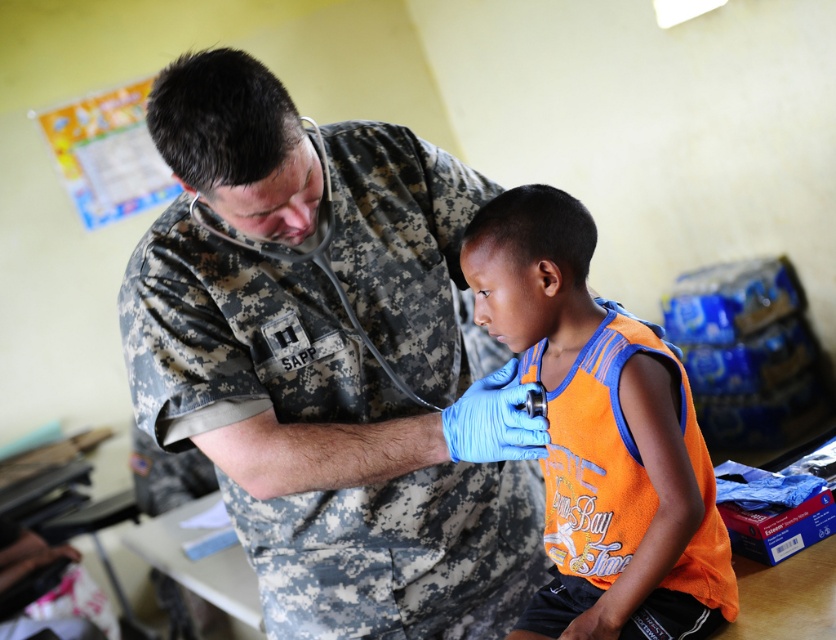
You are a medical student observing the scene. The camouflage uniform at center and the orange fabric shirt at center are both visible. Which clothing item takes up more horizontal space in the image?

The camouflage uniform at center takes up more horizontal space because its width is larger than that of the orange fabric shirt at center.

You are a nurse in the clinic and need to check the vital signs of the patient. Which clothing item should you adjust first to access the patient properly, the camouflage uniform at center or the orange fabric shirt at center?

The orange fabric shirt at center should be adjusted first since the camouflage uniform at center is positioned on the left side of it, meaning the orange fabric shirt at center is closer to the patient and needs to be moved to access the chest area properly.

You are a medical student observing a medic in a clinic. You see the camouflage uniform at center and the orange fabric shirt at center. Based on their positions, which clothing item is closer to the ceiling?

The camouflage uniform at center is located above the orange fabric shirt at center, so it is closer to the ceiling.